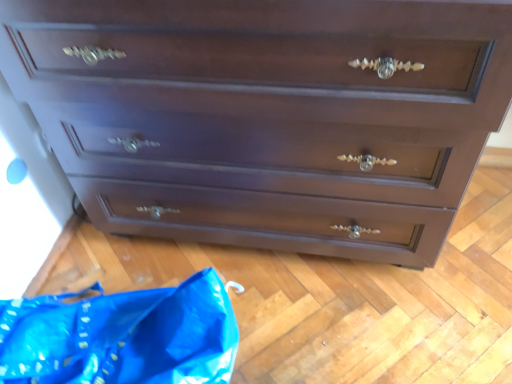
The height and width of the screenshot is (384, 512). I want to click on free space behind blue plastic bag at lower left, so click(x=112, y=260).